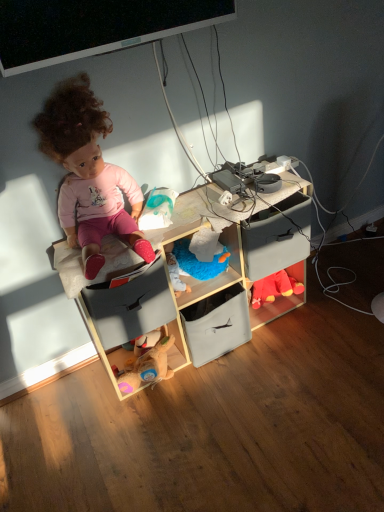
What are the coordinates of `free space above matte plastic drawer at center, the 2th drawer when ordered from right to left (from a real-world perspective)` in the screenshot? It's located at (114, 253).